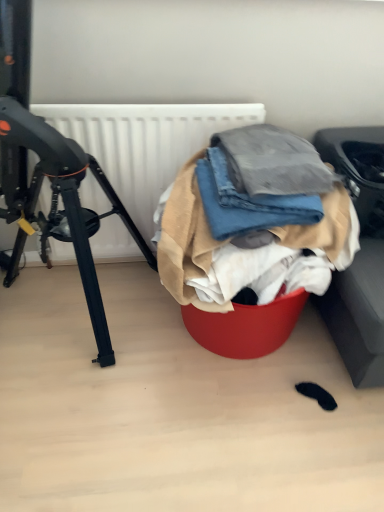
Question: Which direction should I rotate to look at denim fabric at center, which is the second clothing in top-to-bottom order, — up or down?

Choices:
 (A) up
 (B) down

Answer: (A)

Question: Is black matte tripod at left positioned beyond the bounds of denim fabric at center, acting as the second clothing starting from the bottom?

Choices:
 (A) no
 (B) yes

Answer: (B)

Question: Is black matte tripod at left surrounding denim fabric at center, which is the second clothing in top-to-bottom order?

Choices:
 (A) no
 (B) yes

Answer: (A)

Question: Does black matte tripod at left have a smaller size compared to denim fabric at center, which is the second clothing in top-to-bottom order?

Choices:
 (A) yes
 (B) no

Answer: (B)

Question: From a real-world perspective, does black matte tripod at left sit lower than denim fabric at center, which is the second clothing in top-to-bottom order?

Choices:
 (A) yes
 (B) no

Answer: (A)

Question: Is black matte tripod at left at the left side of denim fabric at center, which is the second clothing in top-to-bottom order?

Choices:
 (A) yes
 (B) no

Answer: (A)

Question: Does black matte tripod at left have a lesser width compared to denim fabric at center, acting as the second clothing starting from the bottom?

Choices:
 (A) yes
 (B) no

Answer: (B)

Question: From a real-world perspective, is white matte radiator at upper center beneath black matte tripod at left?

Choices:
 (A) yes
 (B) no

Answer: (A)

Question: Are white matte radiator at upper center and black matte tripod at left located far from each other?

Choices:
 (A) no
 (B) yes

Answer: (A)

Question: From the image's perspective, is white matte radiator at upper center on black matte tripod at left?

Choices:
 (A) yes
 (B) no

Answer: (A)

Question: Does white matte radiator at upper center come in front of black matte tripod at left?

Choices:
 (A) yes
 (B) no

Answer: (B)

Question: Considering the relative sizes of white matte radiator at upper center and black matte tripod at left in the image provided, is white matte radiator at upper center taller than black matte tripod at left?

Choices:
 (A) yes
 (B) no

Answer: (B)

Question: Does white matte radiator at upper center have a greater width compared to black matte tripod at left?

Choices:
 (A) no
 (B) yes

Answer: (A)

Question: Does white matte radiator at upper center have a larger size compared to denim fabric at center, which ranks as the first clothing in bottom-to-top order?

Choices:
 (A) no
 (B) yes

Answer: (A)